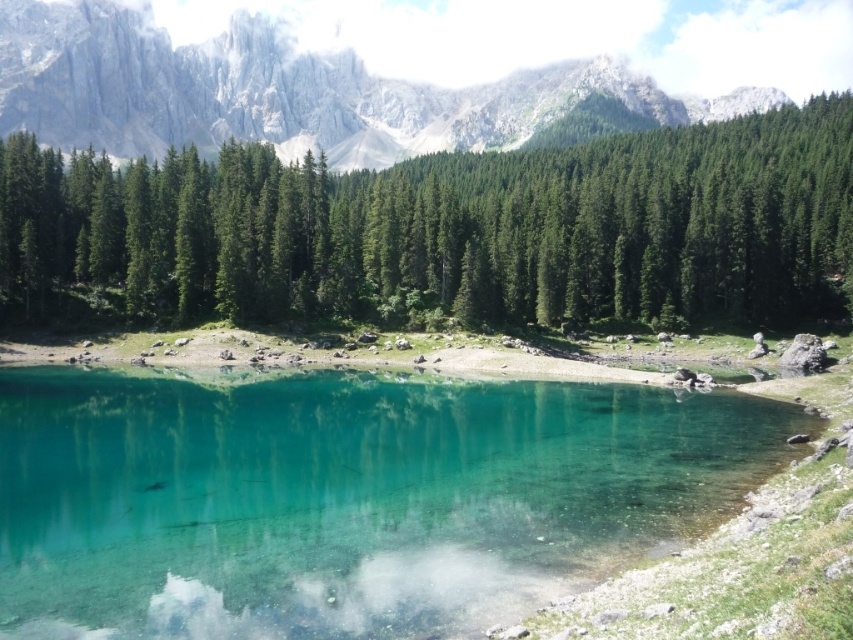
Looking at this image, you are standing on the lakeshore and want to determine which object in the scene is wider. You see the green matte tree at center and the rugged stone mountain at upper center. Which one has a greater width?

The rugged stone mountain at upper center has a greater width than the green matte tree at center.

You are standing at the edge of the lake and see a point marked at coordinates (x=445, y=228). What object does this point correspond to in the scene?

The point at coordinates (x=445, y=228) corresponds to the green matte tree at center.

You are standing at the lakeshore and want to take a photo of the green matte tree at center and the rugged stone mountain at upper center. Which object will appear closer to the camera in the photo?

The green matte tree at center will appear closer to the camera in the photo because it is positioned in front of the rugged stone mountain at upper center.